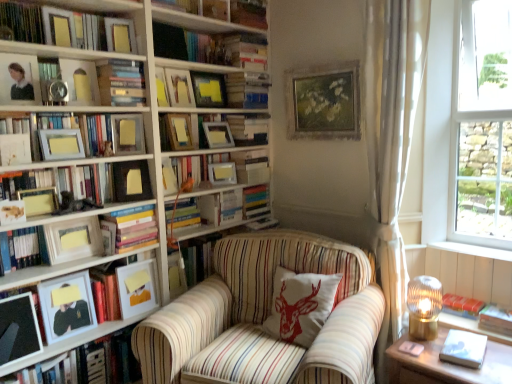
Where is `matte black picture frame at upper left, positioned as the second picture frame in left-to-right order`? matte black picture frame at upper left, positioned as the second picture frame in left-to-right order is located at coordinates (19, 79).

Where is `white paper book at lower right, the 18th book positioned from the top`? white paper book at lower right, the 18th book positioned from the top is located at coordinates (464, 348).

Find the location of a particular element. The width and height of the screenshot is (512, 384). metallic glass lampshade at lower right is located at coordinates (424, 307).

Where is `matte black photo frame at left, positioned as the 6th book in bottom-to-top order`? matte black photo frame at left, positioned as the 6th book in bottom-to-top order is located at coordinates (76, 341).

Image resolution: width=512 pixels, height=384 pixels. I want to click on hardcover book at upper center, the 17th book ordered from the bottom, so click(247, 90).

Identify the location of matte yellow picture frame at upper left, which is counted as the 10th picture frame, starting from the left. (120, 35).

This screenshot has height=384, width=512. I want to click on matte yellow picture frame at upper left, positioned as the 11th picture frame in left-to-right order, so click(x=127, y=134).

Identify the location of matte black picture frame at upper left, positioned as the 16th picture frame in right-to-left order. Image resolution: width=512 pixels, height=384 pixels. (19, 79).

Image resolution: width=512 pixels, height=384 pixels. I want to click on the 3rd picture frame behind when counting from the matte white picture frame at left, the 6th picture frame positioned from the left, so pyautogui.click(x=120, y=35).

Does point (59, 283) come closer to viewer compared to point (124, 43)?

Yes.

Is matte white picture frame at left, which ranks as the twelfth picture frame in right-to-left order, further to camera compared to matte yellow picture frame at upper left, which is counted as the 10th picture frame, starting from the left?

No, it is in front of matte yellow picture frame at upper left, which is counted as the 10th picture frame, starting from the left.

What's the angular difference between matte white picture frame at left, which ranks as the twelfth picture frame in right-to-left order, and matte yellow picture frame at upper left, which is counted as the 10th picture frame, starting from the left,'s facing directions?

matte white picture frame at left, which ranks as the twelfth picture frame in right-to-left order, and matte yellow picture frame at upper left, which is counted as the 10th picture frame, starting from the left, are facing 17.5 degrees away from each other.

Does matte black frame at left, marked as the tenth book in a bottom-to-top arrangement, touch striped fabric armchair at center?

matte black frame at left, marked as the tenth book in a bottom-to-top arrangement, and striped fabric armchair at center are clearly separated.

From a real-world perspective, who is located lower, matte black frame at left, marked as the tenth book in a bottom-to-top arrangement, or striped fabric armchair at center?

striped fabric armchair at center.

In terms of size, does matte black frame at left, marked as the tenth book in a bottom-to-top arrangement, appear bigger or smaller than striped fabric armchair at center?

Clearly, matte black frame at left, marked as the tenth book in a bottom-to-top arrangement, is smaller in size than striped fabric armchair at center.

From the image's perspective, between matte black frame at left, which is the 10th book from top to bottom, and striped fabric armchair at center, who is located below?

striped fabric armchair at center is shown below in the image.

Is matte yellow paper at left, the thirteenth book in the bottom-to-top sequence, facing away from white wood window sill at right?

No, matte yellow paper at left, the thirteenth book in the bottom-to-top sequence,'s orientation is not away from white wood window sill at right.

The width and height of the screenshot is (512, 384). I want to click on the 7th book directly above the white wood window sill at right (from a real-world perspective), so click(67, 128).

Between matte yellow paper at left, the thirteenth book in the bottom-to-top sequence, and white wood window sill at right, which one appears on the right side from the viewer's perspective?

white wood window sill at right is more to the right.

How much distance is there between matte yellow paper at left, the thirteenth book in the bottom-to-top sequence, and white wood window sill at right?

They are 6.47 feet apart.

Based on their sizes in the image, would you say matte yellow picture frame at upper left, positioned as the 11th picture frame in left-to-right order, is bigger or smaller than matte yellow picture frame at upper left, which is counted as the 10th picture frame, starting from the left?

In the image, matte yellow picture frame at upper left, positioned as the 11th picture frame in left-to-right order, appears to be larger than matte yellow picture frame at upper left, which is counted as the 10th picture frame, starting from the left.

Measure the distance from matte yellow picture frame at upper left, positioned as the 11th picture frame in left-to-right order, to matte yellow picture frame at upper left, which is counted as the 10th picture frame, starting from the left.

matte yellow picture frame at upper left, positioned as the 11th picture frame in left-to-right order, and matte yellow picture frame at upper left, which is counted as the 10th picture frame, starting from the left, are 16.12 inches apart from each other.

At what (x,y) coordinates should I click in order to perform the action: click on the 2nd picture frame behind the matte yellow picture frame at upper left, which is counted as the 10th picture frame, starting from the left. Please return your answer as a coordinate pair (x, y). The image size is (512, 384). Looking at the image, I should click on (127, 134).

Does point (133, 127) appear closer or farther from the camera than point (120, 26)?

Point (133, 127).

Measure the distance between matte yellow picture frame at upper left, marked as the ninth picture frame in a right-to-left arrangement, and hardcover book at upper center, placed as the 3th book when sorted from top to bottom.

matte yellow picture frame at upper left, marked as the ninth picture frame in a right-to-left arrangement, is 95.35 centimeters away from hardcover book at upper center, placed as the 3th book when sorted from top to bottom.

Between matte yellow picture frame at upper left, marked as the ninth picture frame in a left-to-right arrangement, and hardcover book at upper center, placed as the 3th book when sorted from top to bottom, which one has less height?

With less height is hardcover book at upper center, placed as the 3th book when sorted from top to bottom.

Is there a large distance between matte yellow picture frame at upper left, marked as the ninth picture frame in a right-to-left arrangement, and hardcover book at upper center, the 17th book ordered from the bottom?

No, matte yellow picture frame at upper left, marked as the ninth picture frame in a right-to-left arrangement, is not far from hardcover book at upper center, the 17th book ordered from the bottom.

Between point (89, 93) and point (269, 81), which one is positioned behind?

The point (269, 81) is farther.

Is white wood window sill at right surrounded by matte wooden picture frame at upper center, the fourteenth picture frame positioned from the left?

No, white wood window sill at right is not surrounded by matte wooden picture frame at upper center, the fourteenth picture frame positioned from the left.

I want to click on the 12th picture frame above the white wood window sill at right (from a real-world perspective), so click(209, 90).

Is matte wooden picture frame at upper center, placed as the fourth picture frame when sorted from right to left, oriented towards white wood window sill at right?

No, matte wooden picture frame at upper center, placed as the fourth picture frame when sorted from right to left, is not aimed at white wood window sill at right.

Is matte wooden picture frame at upper center, placed as the fourth picture frame when sorted from right to left, smaller than white wood window sill at right?

Incorrect, matte wooden picture frame at upper center, placed as the fourth picture frame when sorted from right to left, is not smaller in size than white wood window sill at right.

From a real-world perspective, which picture frame is the 2nd one underneath the stone window at right? Please provide its 2D coordinates.

[(218, 135)]

From the image's perspective, which one is positioned lower, stone window at right or matte yellow picture frame at upper center, which is the 15th picture frame from left to right?

matte yellow picture frame at upper center, which is the 15th picture frame from left to right, is shown below in the image.

Is stone window at right to the right of matte yellow picture frame at upper center, which is the 15th picture frame from left to right, from the viewer's perspective?

Yes.

Consider the image. Is stone window at right positioned behind matte yellow picture frame at upper center, which is the 15th picture frame from left to right?

No, stone window at right is closer to the camera.

Find the location of a particular element. The width and height of the screenshot is (512, 384). picture frame that is the 3rd one when counting backward from the matte white picture frame at left, the 6th picture frame positioned from the left is located at coordinates (120, 35).

In the image, there is a matte black frame at left, which is the 10th book from top to bottom. Identify the location of chair below it (from a real-world perspective). This screenshot has width=512, height=384. (263, 318).

When comparing their distances from matte yellow picture frame at upper left, which is counted as the 10th picture frame, starting from the left, does matte white picture frame at left, marked as the eighth picture frame in a left-to-right arrangement, or yellow paper at left, the 2th paperback book when ordered from right to left, seem further?

yellow paper at left, the 2th paperback book when ordered from right to left.

From the picture: Which object lies nearer to the anchor point matte white book at left, the twelfth book in the bottom-to-top sequence, matte gold picture frame at left, which appears as the fourth picture frame when viewed from the left, or hardcover book at left, the thirteenth book positioned from the top?

matte gold picture frame at left, which appears as the fourth picture frame when viewed from the left, is closer to matte white book at left, the twelfth book in the bottom-to-top sequence.

Estimate the real-world distances between objects in this image. Which object is further from matte gold picture frame at left, which appears as the fourth picture frame when viewed from the left, white paper book at lower right, the 18th book positioned from the top, or matte gold picture frame at upper left, the seventh picture frame viewed from the left?

Based on the image, white paper book at lower right, the 18th book positioned from the top, appears to be further to matte gold picture frame at left, which appears as the fourth picture frame when viewed from the left.

Which object lies nearer to the anchor point matte gold picture frame at upper left, the seventh picture frame viewed from the left, white sheer curtain at right or hardcover book at left, the thirteenth book positioned from the top?

The object closer to matte gold picture frame at upper left, the seventh picture frame viewed from the left, is hardcover book at left, the thirteenth book positioned from the top.

From the image, which object appears to be farther from matte yellow picture frame at upper left, marked as the ninth picture frame in a right-to-left arrangement, matte white picture frame at left, the 10th picture frame when ordered from right to left, or matte gold picture frame at left, which appears as the fourth picture frame when viewed from the left?

matte white picture frame at left, the 10th picture frame when ordered from right to left, is further to matte yellow picture frame at upper left, marked as the ninth picture frame in a right-to-left arrangement.

Considering their positions, is matte yellow picture frame at upper left, positioned as the 11th picture frame in left-to-right order, positioned further to wooden picture frame at upper center, the 1th picture frame from the right, than yellow paper at left, the 1th paperback book from the left?

yellow paper at left, the 1th paperback book from the left, is further to wooden picture frame at upper center, the 1th picture frame from the right.

Looking at the image, which one is located closer to matte black picture frame at lower left, arranged as the seventeenth picture frame when viewed from the right, white sheer curtain at right or matte yellow picture frame at upper left, marked as the ninth picture frame in a right-to-left arrangement?

matte yellow picture frame at upper left, marked as the ninth picture frame in a right-to-left arrangement.

Which object lies nearer to the anchor point hardcover book at right, the 16th book in the top-to-bottom sequence, striped fabric armchair at center or matte gold picture frame at upper left, which is the eleventh picture frame from right to left?

Among the two, striped fabric armchair at center is located nearer to hardcover book at right, the 16th book in the top-to-bottom sequence.

At what (x,y) coordinates should I click in order to perform the action: click on lamp between matte black picture frame at lower left, the 1th picture frame viewed from the left, and hardcover book at right, the first paperback book when ordered from right to left. Please return your answer as a coordinate pair (x, y). Looking at the image, I should click on (424, 307).

This screenshot has height=384, width=512. In order to click on table situated between matte yellow picture frame at upper left, marked as the ninth picture frame in a left-to-right arrangement, and hardcover book at right, the first paperback book when ordered from right to left, from left to right in this screenshot , I will do `click(446, 364)`.

Find the location of a particular element. The width and height of the screenshot is (512, 384). lamp situated between matte gold picture frame at left, the 14th picture frame when ordered from right to left, and wooden table at lower right from left to right is located at coordinates (424, 307).

Identify the location of bookcase between matte black photo frame at left, which is the 14th book from top to bottom, and hardcover book at right, arranged as the 17th book when viewed from the top, in the horizontal direction. This screenshot has height=384, width=512. [139, 106].